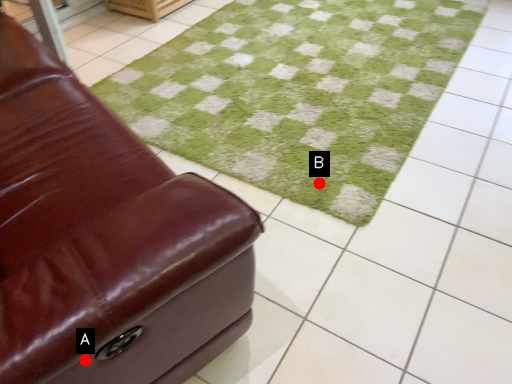
Question: Two points are circled on the image, labeled by A and B beside each circle. Which point is closer to the camera?

Choices:
 (A) A is closer
 (B) B is closer

Answer: (A)